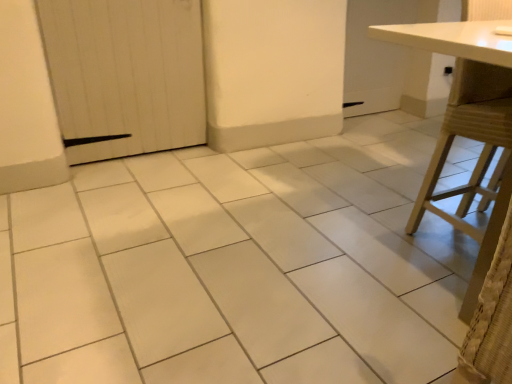
From a real-world perspective, give me the position of a free point above white wood door at left. Please provide its 2D coordinates.

[(0.230, -0.001)]